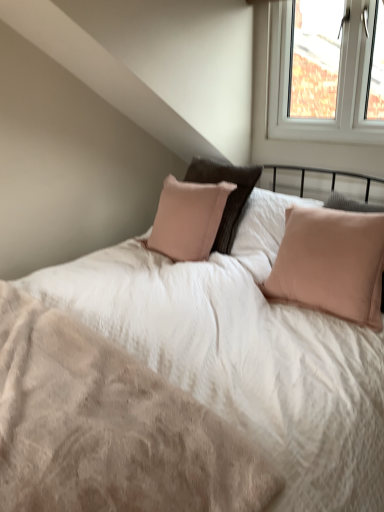
Question: From a real-world perspective, is white plastic window at upper right beneath pale pink fabric pillow at right?

Choices:
 (A) yes
 (B) no

Answer: (B)

Question: Considering the relative positions of white plastic window at upper right and pale pink fabric pillow at right in the image provided, is white plastic window at upper right in front of pale pink fabric pillow at right?

Choices:
 (A) yes
 (B) no

Answer: (B)

Question: Does white plastic window at upper right come behind pale pink fabric pillow at right?

Choices:
 (A) yes
 (B) no

Answer: (A)

Question: Considering the relative positions of white plastic window at upper right and pale pink fabric pillow at right in the image provided, is white plastic window at upper right to the left of pale pink fabric pillow at right from the viewer's perspective?

Choices:
 (A) no
 (B) yes

Answer: (A)

Question: Is white plastic window at upper right smaller than pale pink fabric pillow at right?

Choices:
 (A) no
 (B) yes

Answer: (B)

Question: Is pale pink fabric pillow at right at the back of white plastic window at upper right?

Choices:
 (A) no
 (B) yes

Answer: (A)

Question: Can you confirm if pale pink fabric pillow at right is shorter than beige soft fabric mattress at center?

Choices:
 (A) no
 (B) yes

Answer: (A)

Question: Is pale pink fabric pillow at right positioned behind beige soft fabric mattress at center?

Choices:
 (A) no
 (B) yes

Answer: (B)

Question: Is pale pink fabric pillow at right to the left of beige soft fabric mattress at center from the viewer's perspective?

Choices:
 (A) no
 (B) yes

Answer: (A)

Question: From the image's perspective, is pale pink fabric pillow at right under beige soft fabric mattress at center?

Choices:
 (A) no
 (B) yes

Answer: (A)

Question: Can you see pale pink fabric pillow at right touching beige soft fabric mattress at center?

Choices:
 (A) yes
 (B) no

Answer: (B)

Question: Is pale pink fabric pillow at right oriented towards beige soft fabric mattress at center?

Choices:
 (A) yes
 (B) no

Answer: (A)

Question: Considering the relative sizes of beige soft fabric mattress at center and white plastic window at upper right in the image provided, is beige soft fabric mattress at center shorter than white plastic window at upper right?

Choices:
 (A) yes
 (B) no

Answer: (A)